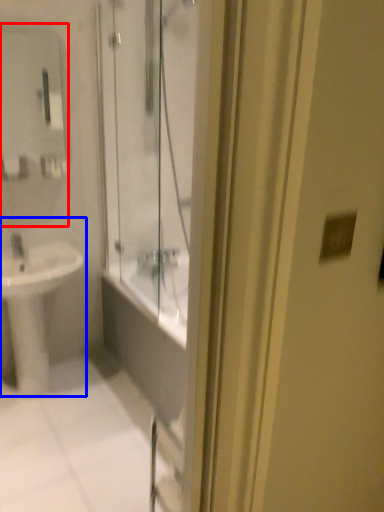
Question: Which point is further to the camera, mirror (highlighted by a red box) or sink (highlighted by a blue box)?

Choices:
 (A) mirror
 (B) sink

Answer: (A)